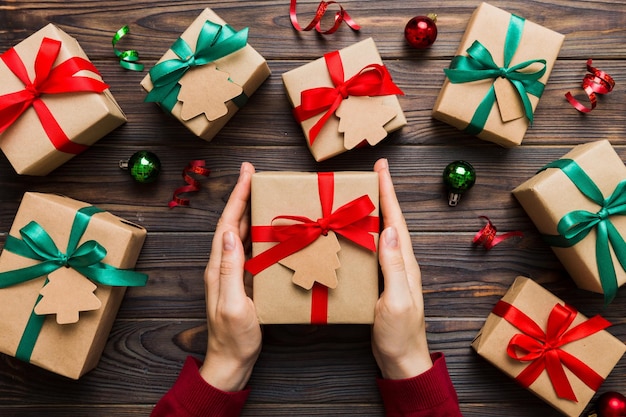
Locate an element on the screen. The width and height of the screenshot is (626, 417). decorative balls in green and red is located at coordinates (615, 404), (458, 176), (421, 34), (141, 168).